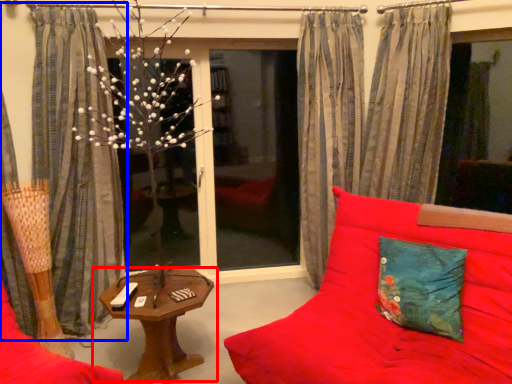
Question: Which point is further to the camera, table (highlighted by a red box) or curtain (highlighted by a blue box)?

Choices:
 (A) table
 (B) curtain

Answer: (B)